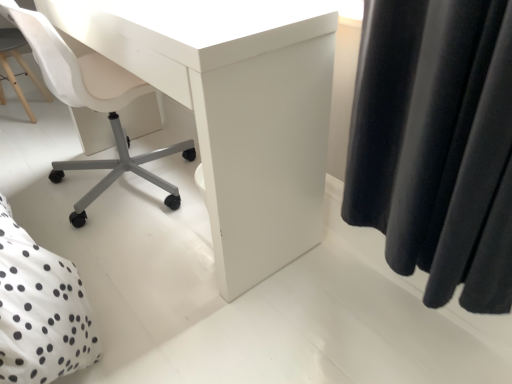
This screenshot has height=384, width=512. Identify the location of vacant space to the right of white dotted fabric at lower left. (193, 281).